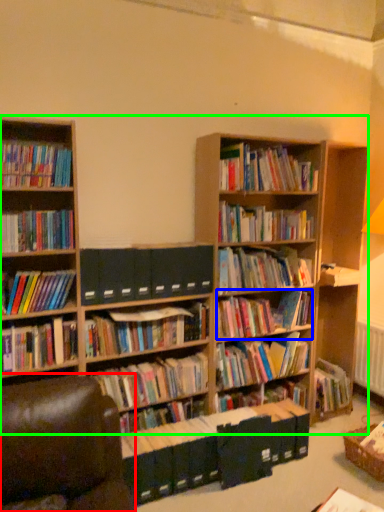
Question: Estimate the real-world distances between objects in this image. Which object is farther from swivel chair (highlighted by a red box), book (highlighted by a blue box) or bookcase (highlighted by a green box)?

Choices:
 (A) book
 (B) bookcase

Answer: (A)